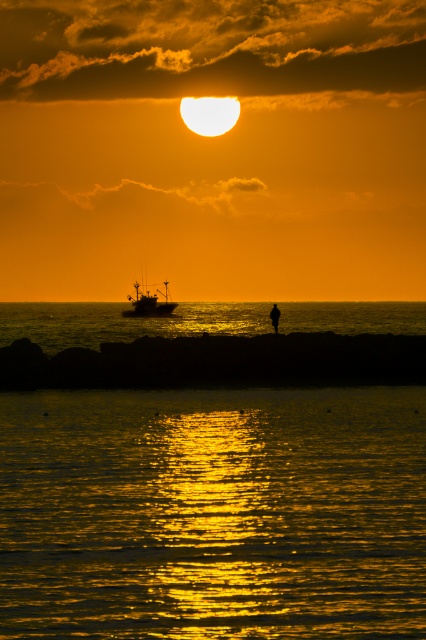
Consider the image. Is the position of smooth rock shoreline at lower center more distant than that of silhouette fishing boat at center?

No, smooth rock shoreline at lower center is closer to the viewer.

Looking at this image, which is more to the right, smooth rock shoreline at lower center or silhouette fishing boat at center?

smooth rock shoreline at lower center

Which is behind, point (273, 355) or point (164, 305)?

The point (164, 305) is behind.

In order to click on smooth rock shoreline at lower center in this screenshot , I will do `click(218, 362)`.

This screenshot has height=640, width=426. What do you see at coordinates (213, 513) in the screenshot? I see `glistening golden water at center` at bounding box center [213, 513].

Which is behind, point (138, 422) or point (158, 310)?

Positioned behind is point (158, 310).

At what (x,y) coordinates should I click in order to perform the action: click on glistening golden water at center. Please return your answer as a coordinate pair (x, y). The image size is (426, 640). Looking at the image, I should click on (213, 513).

Between point (74, 452) and point (100, 365), which one is positioned in front?

Point (74, 452)

Can you confirm if glistening golden water at center is wider than smooth rock shoreline at lower center?

No, glistening golden water at center is not wider than smooth rock shoreline at lower center.

Is point (342, 541) closer to viewer compared to point (195, 346)?

Yes, it is.

The width and height of the screenshot is (426, 640). Identify the location of glistening golden water at center. (213, 513).